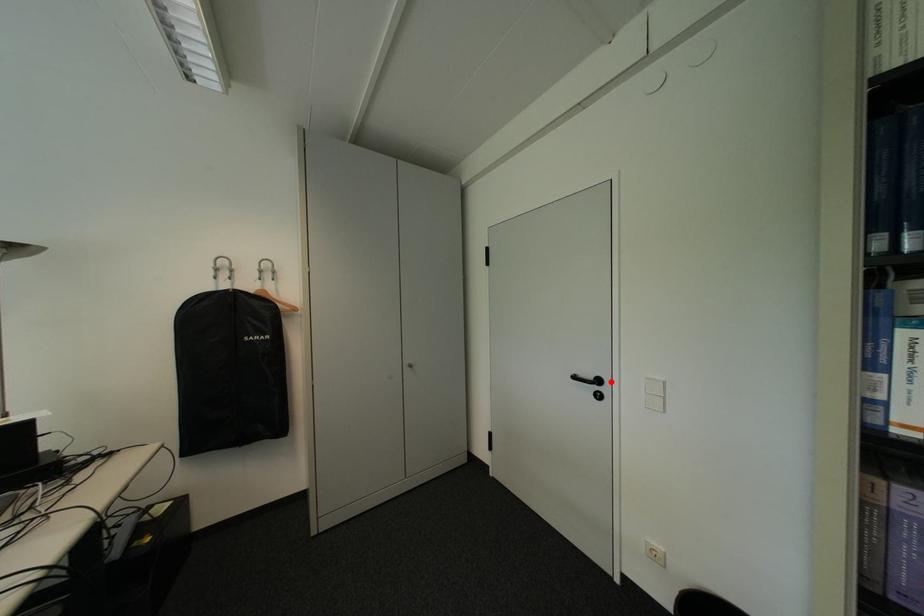
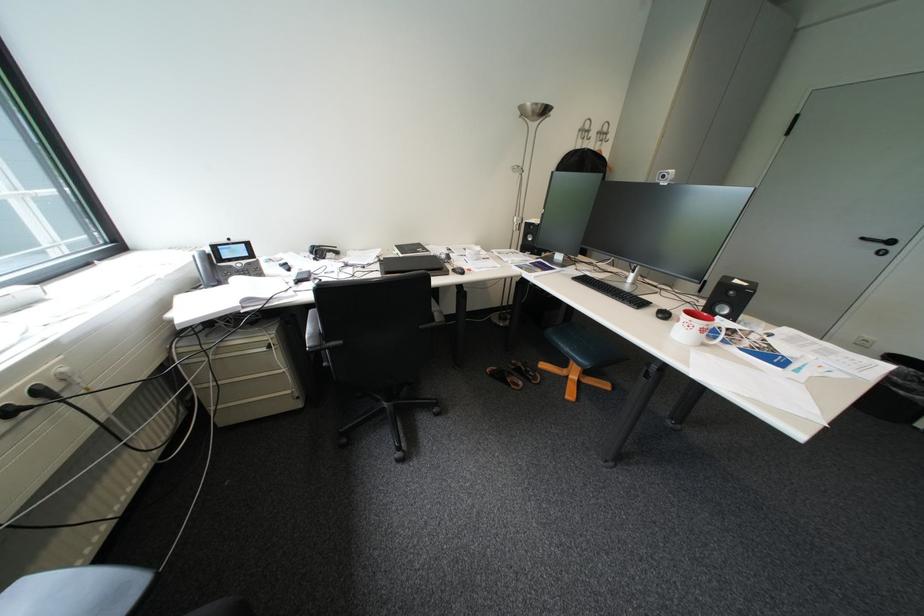
The point at the highlighted location is marked in the first image. Where is the corresponding point in the second image?

(904, 243)